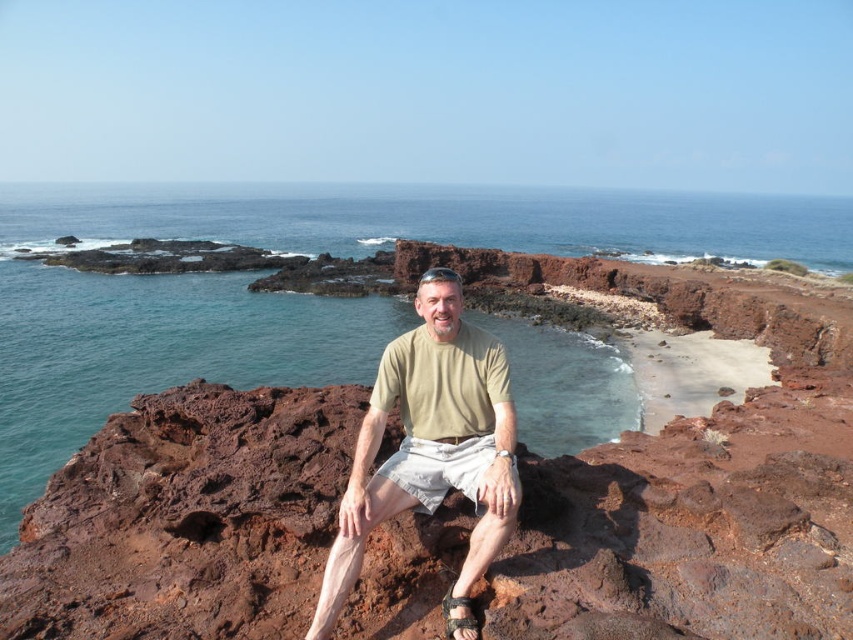
Question: Is clear blue water at center above light brown cotton shirt at center?

Choices:
 (A) no
 (B) yes

Answer: (B)

Question: Among these objects, which one is nearest to the camera?

Choices:
 (A) light brown cotton shirt at center
 (B) clear blue water at center

Answer: (A)

Question: Is clear blue water at center behind light brown cotton shirt at center?

Choices:
 (A) no
 (B) yes

Answer: (B)

Question: Is clear blue water at center positioned in front of light brown cotton shirt at center?

Choices:
 (A) no
 (B) yes

Answer: (A)